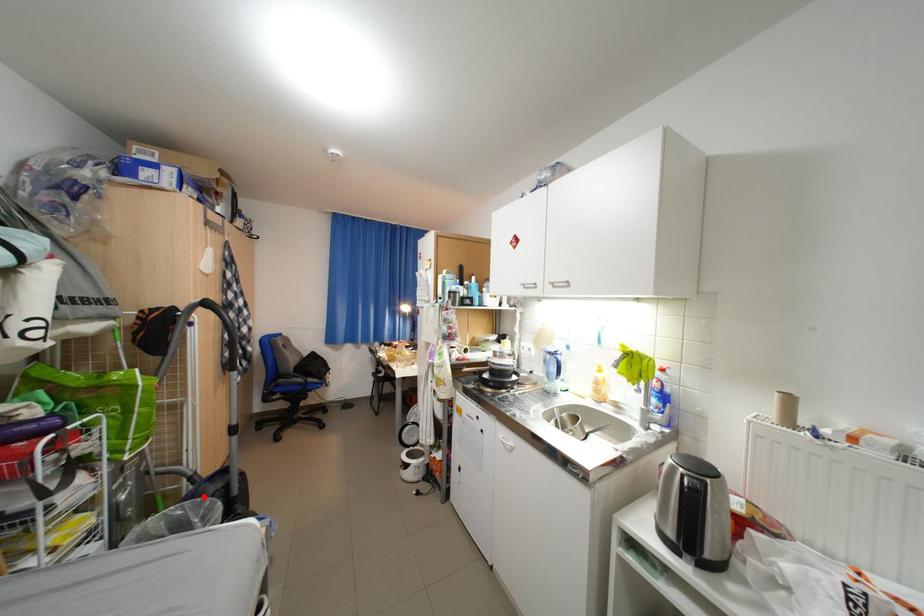
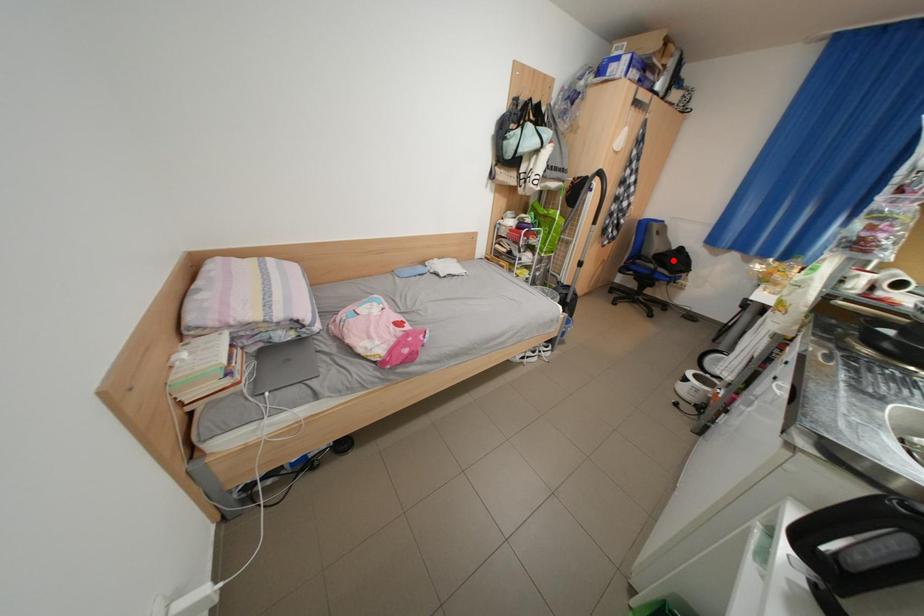
I am providing you with two images of the same scene from different viewpoints. A red point is marked on the first image and another point is marked on the second image. Does the point marked in image1 correspond to the same location as the one in image2?

No